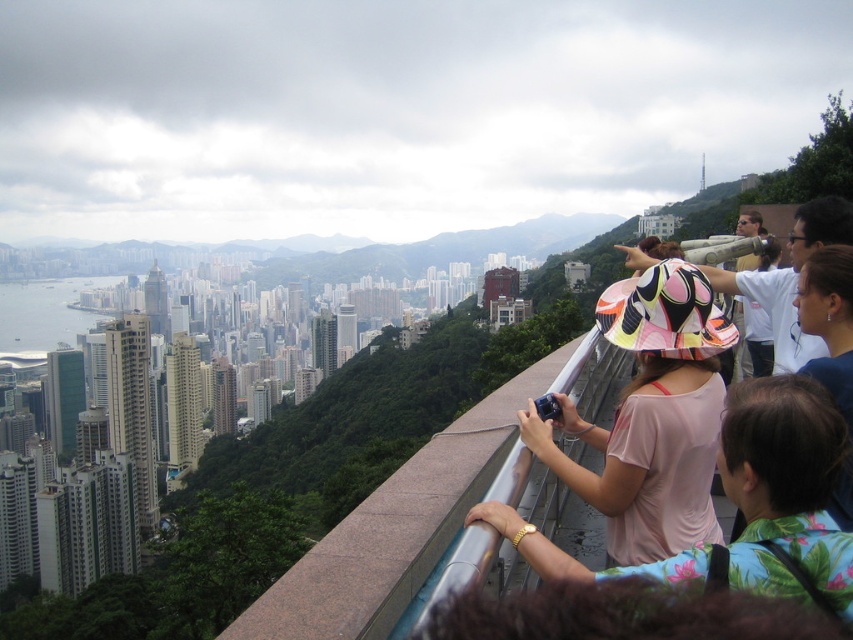
Question: Which of the following is the farthest from the observer?

Choices:
 (A) pink fabric dress at center
 (B) blue fabric at upper right
 (C) pink fabric hat at center

Answer: (C)

Question: Does pink fabric hat at center have a lesser width compared to blue fabric at upper right?

Choices:
 (A) no
 (B) yes

Answer: (A)

Question: Is pink fabric dress at center bigger than blue fabric at upper right?

Choices:
 (A) no
 (B) yes

Answer: (B)

Question: Based on their relative distances, which object is nearer to the blue fabric at upper right?

Choices:
 (A) pink fabric dress at center
 (B) pink fabric hat at center

Answer: (A)

Question: Considering the relative positions of pink fabric hat at center and blue fabric at upper right in the image provided, where is pink fabric hat at center located with respect to blue fabric at upper right?

Choices:
 (A) below
 (B) above

Answer: (A)

Question: Which object is the farthest from the blue fabric at upper right?

Choices:
 (A) pink fabric hat at center
 (B) pink fabric dress at center

Answer: (A)